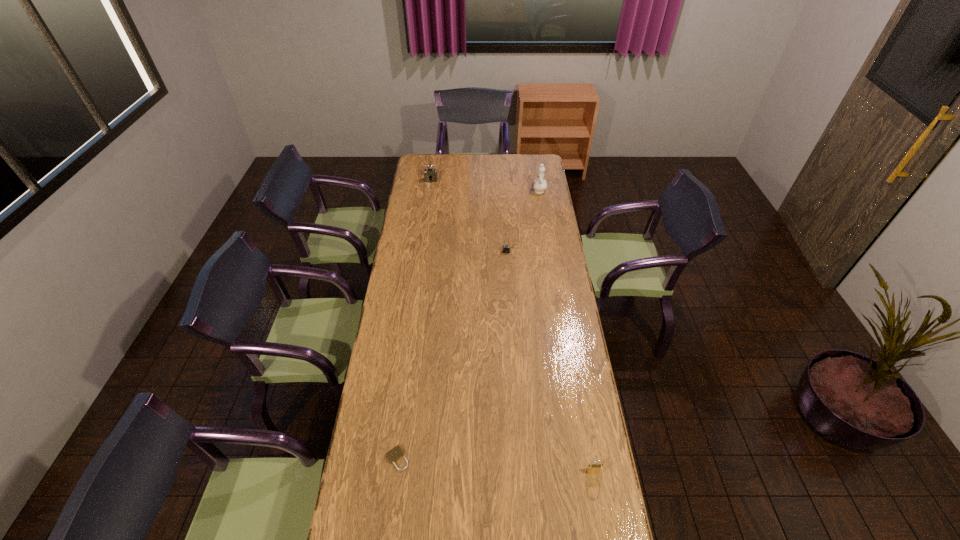
The image size is (960, 540). Identify the location of object that can be found as the closest to the farthest padlock. (539, 184).

Point out which object is positioned as the nearest to the third nearest object. Please provide its 2D coordinates. Your answer should be formatted as a tuple, i.e. [(x, y)], where the tuple contains the x and y coordinates of a point satisfying the conditions above.

[(539, 184)]

This screenshot has width=960, height=540. Find the location of `padlock that is the third closest to the rightmost padlock`. padlock that is the third closest to the rightmost padlock is located at coordinates (430, 174).

The width and height of the screenshot is (960, 540). Identify the location of padlock that is the second closest to the farthest object. (394, 454).

Locate an element on the screen. The height and width of the screenshot is (540, 960). free space in the image that satisfies the following two spatial constraints: 1. at the front of the tallest padlock near the keyhole; 2. on the left side of the shortest object is located at coordinates (394, 458).